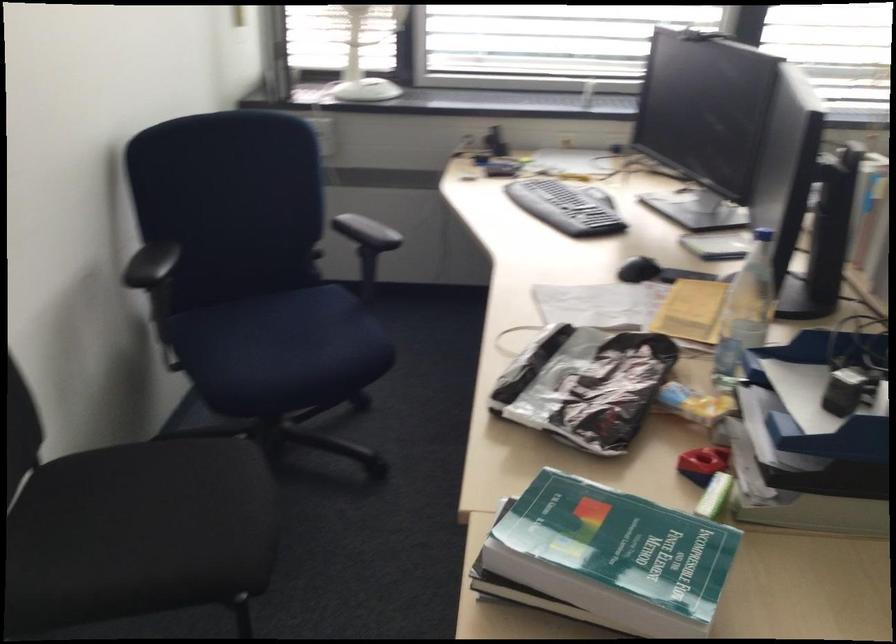
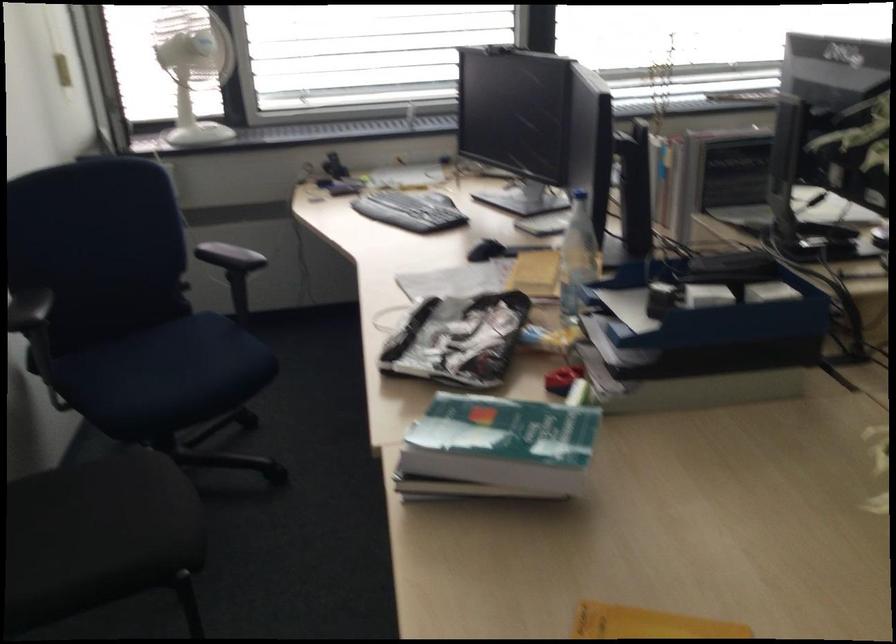
Question: The camera is either moving clockwise (left) or counter-clockwise (right) around the object. The first image is from the beginning of the video and the second image is from the end. Is the camera moving left or right when shooting the video?

Choices:
 (A) Left
 (B) Right

Answer: (A)